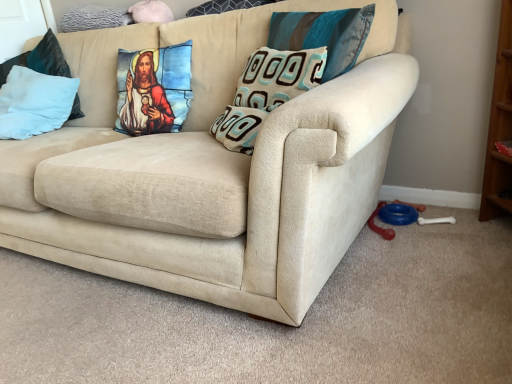
Question: Could you tell me if teal fabric pillow at upper center, which is the 3th pillow from left to right, is facing teal and brown textured pillow at center, acting as the second pillow starting from the right?

Choices:
 (A) yes
 (B) no

Answer: (B)

Question: Considering the relative positions of teal fabric pillow at upper center, which is the 3th pillow from left to right, and teal and brown textured pillow at center, acting as the second pillow starting from the right, in the image provided, is teal fabric pillow at upper center, which is the 3th pillow from left to right, in front of teal and brown textured pillow at center, acting as the second pillow starting from the right,?

Choices:
 (A) no
 (B) yes

Answer: (A)

Question: From a real-world perspective, is teal fabric pillow at upper center, the 3th pillow in the right-to-left sequence, on teal and brown textured pillow at center, acting as the second pillow starting from the right?

Choices:
 (A) yes
 (B) no

Answer: (A)

Question: Does teal fabric pillow at upper center, the 3th pillow in the right-to-left sequence, have a smaller size compared to teal and brown textured pillow at center, acting as the second pillow starting from the right?

Choices:
 (A) no
 (B) yes

Answer: (B)

Question: From the image's perspective, would you say teal fabric pillow at upper center, the 3th pillow in the right-to-left sequence, is shown under teal and brown textured pillow at center, acting as the second pillow starting from the right?

Choices:
 (A) no
 (B) yes

Answer: (A)

Question: Is point (45, 124) positioned closer to the camera than point (403, 71)?

Choices:
 (A) farther
 (B) closer

Answer: (A)

Question: Looking at the image, does light blue plush pillow at left, the 5th pillow viewed from the right, seem bigger or smaller compared to beige fabric couch at center?

Choices:
 (A) small
 (B) big

Answer: (A)

Question: In the image, is light blue plush pillow at left, the 5th pillow viewed from the right, positioned in front of or behind beige fabric couch at center?

Choices:
 (A) front
 (B) behind

Answer: (B)

Question: From a real-world perspective, is light blue plush pillow at left, which appears as the first pillow when viewed from the left, physically located above or below beige fabric couch at center?

Choices:
 (A) below
 (B) above

Answer: (B)

Question: In terms of width, does teal fabric pillow at upper center, the first pillow from the right, look wider or thinner when compared to teal and brown textured pillow at center, acting as the second pillow starting from the right?

Choices:
 (A) thin
 (B) wide

Answer: (A)

Question: From a real-world perspective, is teal fabric pillow at upper center, which is counted as the fifth pillow, starting from the left, above or below teal and brown textured pillow at center, the fourth pillow viewed from the left?

Choices:
 (A) below
 (B) above

Answer: (B)

Question: Is teal fabric pillow at upper center, which is counted as the fifth pillow, starting from the left, to the left or to the right of teal and brown textured pillow at center, acting as the second pillow starting from the right, in the image?

Choices:
 (A) right
 (B) left

Answer: (A)

Question: Considering the positions of teal fabric pillow at upper center, which is counted as the fifth pillow, starting from the left, and teal and brown textured pillow at center, acting as the second pillow starting from the right, in the image, is teal fabric pillow at upper center, which is counted as the fifth pillow, starting from the left, taller or shorter than teal and brown textured pillow at center, acting as the second pillow starting from the right,?

Choices:
 (A) tall
 (B) short

Answer: (A)

Question: Is beige fabric couch at center taller or shorter than light blue plush pillow at left, the 5th pillow viewed from the right?

Choices:
 (A) short
 (B) tall

Answer: (B)

Question: Relative to light blue plush pillow at left, the 5th pillow viewed from the right, is beige fabric couch at center in front or behind?

Choices:
 (A) behind
 (B) front

Answer: (B)